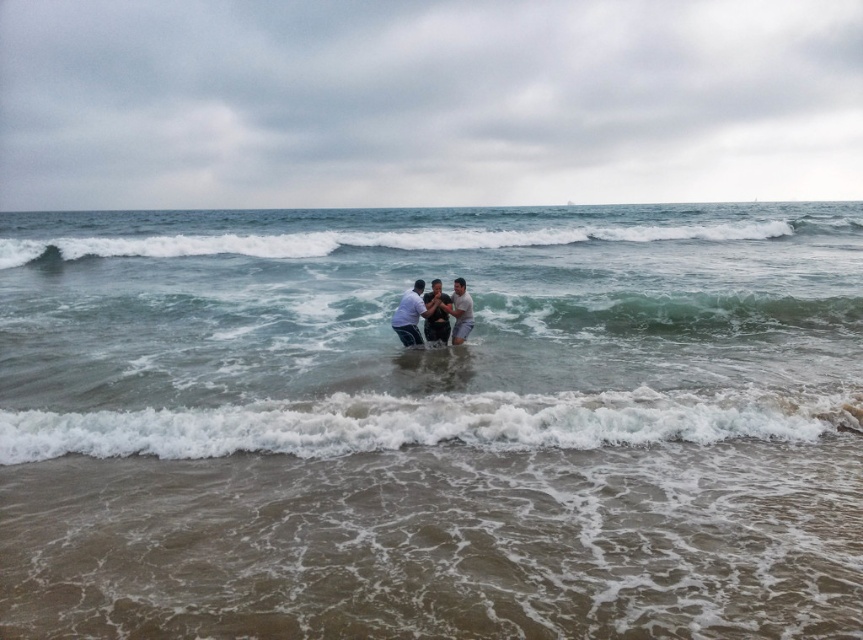
Question: Which point is farther from the camera taking this photo?

Choices:
 (A) (616, 392)
 (B) (416, 282)
 (C) (467, 294)
 (D) (424, 296)

Answer: (B)

Question: Which object is positioned closest to the white foamy wave at lower center?

Choices:
 (A) white foamy wave at center
 (B) smooth skin man at center
 (C) clear water at center

Answer: (B)

Question: Which object is the closest to the light gray fabric man at center?

Choices:
 (A) smooth skin couple at center
 (B) clear water at center

Answer: (A)

Question: Can you confirm if smooth skin couple at center is wider than smooth skin man at center?

Choices:
 (A) yes
 (B) no

Answer: (A)

Question: In this image, where is clear water at center located relative to white foamy wave at center?

Choices:
 (A) below
 (B) above

Answer: (A)

Question: Observing the image, what is the correct spatial positioning of white foamy wave at center in reference to light gray fabric man at center?

Choices:
 (A) below
 (B) above

Answer: (B)